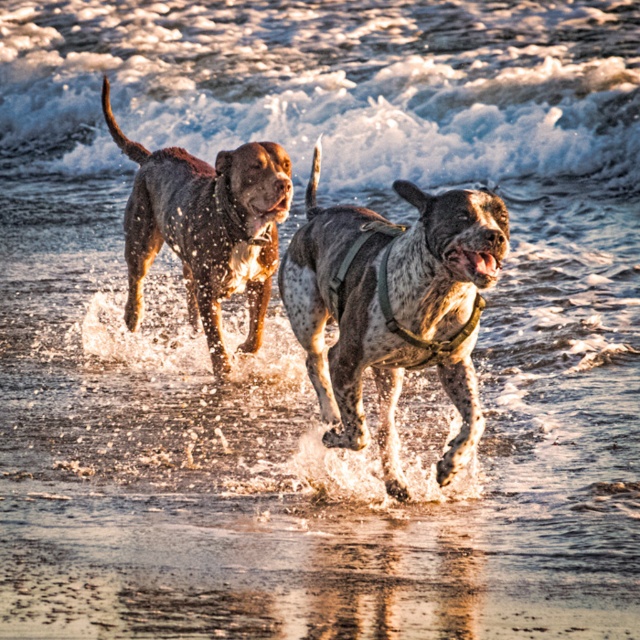
Is speckled fur dog at center smaller than shiny brown dog at center?

Correct, speckled fur dog at center occupies less space than shiny brown dog at center.

Can you confirm if speckled fur dog at center is positioned to the left of shiny brown dog at center?

In fact, speckled fur dog at center is to the right of shiny brown dog at center.

Does point (300, 291) come in front of point (218, 305)?

Yes, point (300, 291) is in front of point (218, 305).

Where is `speckled fur dog at center`? The height and width of the screenshot is (640, 640). speckled fur dog at center is located at coordinates (394, 308).

Can you confirm if white textured foam at upper center is positioned to the left of shiny brown dog at center?

Yes, white textured foam at upper center is to the left of shiny brown dog at center.

Which of these two, white textured foam at upper center or shiny brown dog at center, stands shorter?

Standing shorter between the two is shiny brown dog at center.

Is point (305, 125) positioned in front of point (200, 256)?

No.

Locate an element on the screen. Image resolution: width=640 pixels, height=640 pixels. white textured foam at upper center is located at coordinates (340, 115).

Which is in front, point (540, 163) or point (330, 440)?

Point (330, 440) is more forward.

The image size is (640, 640). I want to click on white textured foam at upper center, so click(x=340, y=115).

Is point (428, 77) less distant than point (438, 262)?

No.

Where is `white textured foam at upper center`? Image resolution: width=640 pixels, height=640 pixels. white textured foam at upper center is located at coordinates (340, 115).